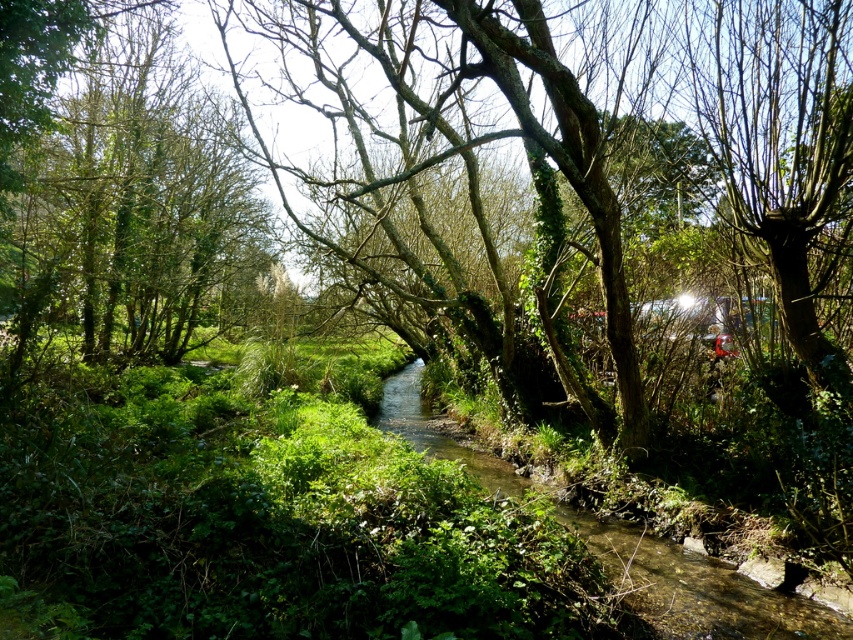
You are standing at the edge of the stream and want to walk to the clear water at center. Which direction should you move to avoid the green leafy tree at left?

Since the green leafy tree at left is to the left of clear water at center, you should move to the right to avoid it and reach the clear water at center.